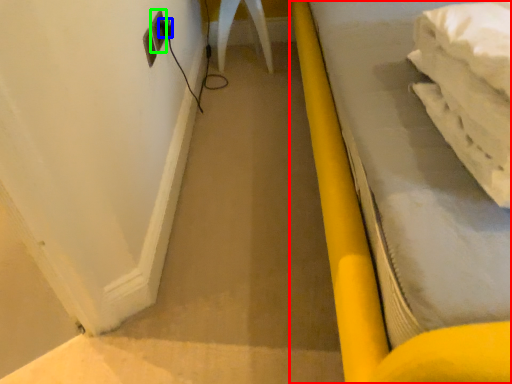
Question: Estimate the real-world distances between objects in this image. Which object is farther from furniture (highlighted by a red box), plug (highlighted by a blue box) or electric outlet (highlighted by a green box)?

Choices:
 (A) plug
 (B) electric outlet

Answer: (A)